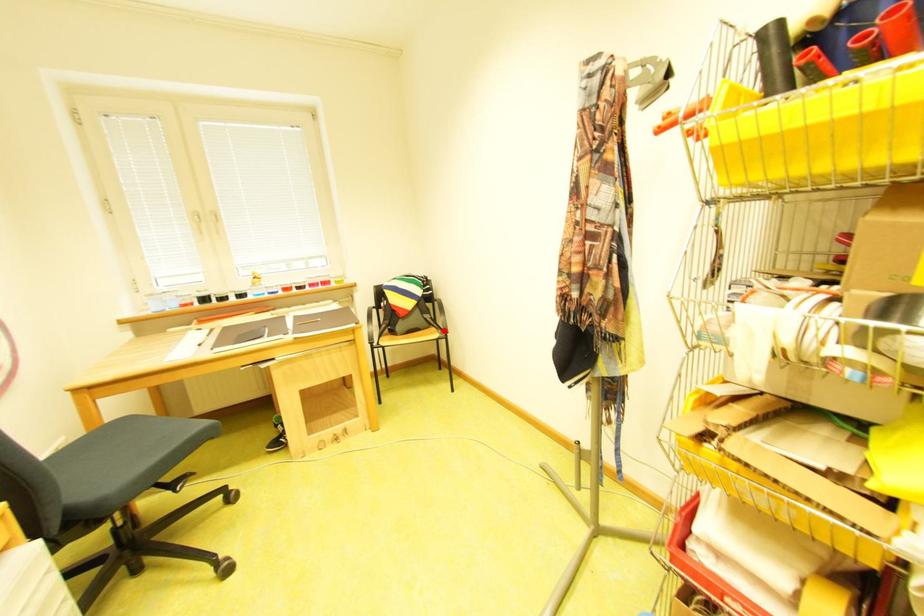
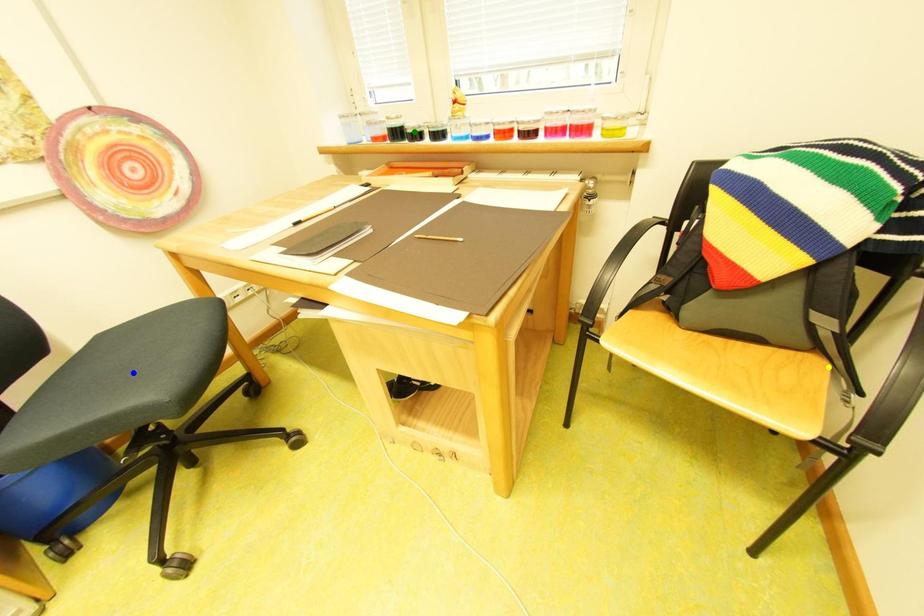
Question: I am providing you with two images of the same scene from different viewpoints. A red point is marked on the first image. You are given multiple points on the second image. In image 2, which mark is for the same physical point as the one in image 1?

Choices:
 (A) blue point
 (B) green point
 (C) yellow point

Answer: (C)